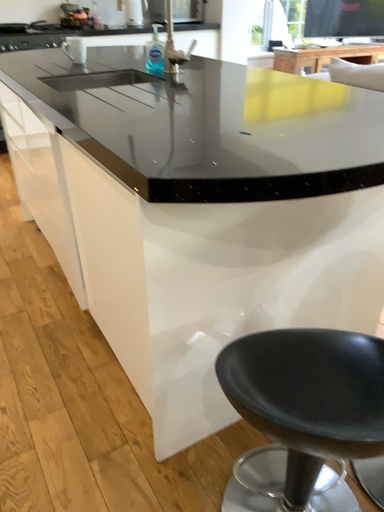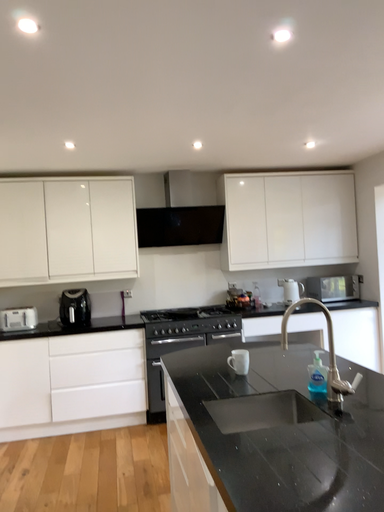
Question: How did the camera likely rotate when shooting the video?

Choices:
 (A) rotated downward
 (B) rotated upward

Answer: (B)